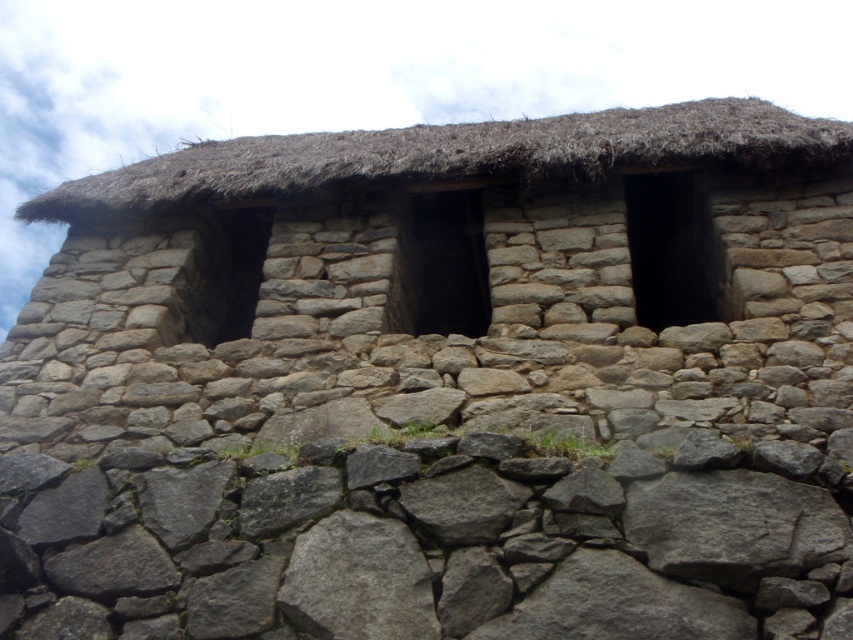
Is natural stone hut at center to the left of gray rough stone at lower center from the viewer's perspective?

Yes, natural stone hut at center is to the left of gray rough stone at lower center.

Based on the photo, is natural stone hut at center above gray rough stone at lower center?

Yes, natural stone hut at center is above gray rough stone at lower center.

Between point (109, 396) and point (270, 632), which one is positioned in front?

Point (270, 632) is in front.

Find the location of `natural stone hut at center`. natural stone hut at center is located at coordinates (448, 285).

In the scene shown: Does gray rough stone at lower center have a greater height compared to brown thatch at upper center?

Incorrect, gray rough stone at lower center's height is not larger of brown thatch at upper center's.

Which is in front, point (488, 436) or point (708, 163)?

Point (488, 436) is in front.

Find the location of a particular element. The height and width of the screenshot is (640, 853). gray rough stone at lower center is located at coordinates (426, 545).

Is natural stone hut at center wider than brown thatch at upper center?

No.

Who is taller, natural stone hut at center or brown thatch at upper center?

Standing taller between the two is brown thatch at upper center.

Is point (641, 264) behind point (144, 166)?

No.

Find the location of `natural stone hut at center`. natural stone hut at center is located at coordinates (448, 285).